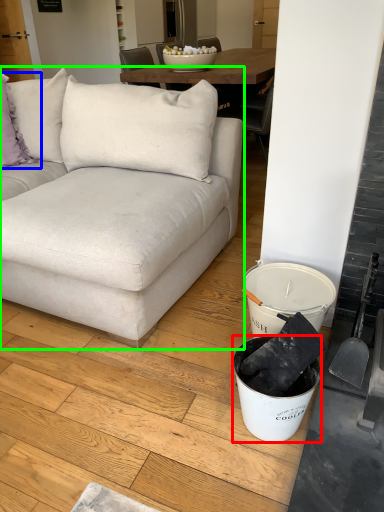
Question: Based on their relative distances, which object is nearer to bucket (highlighted by a red box)? Choose from pillow (highlighted by a blue box) and studio couch (highlighted by a green box).

Choices:
 (A) pillow
 (B) studio couch

Answer: (B)